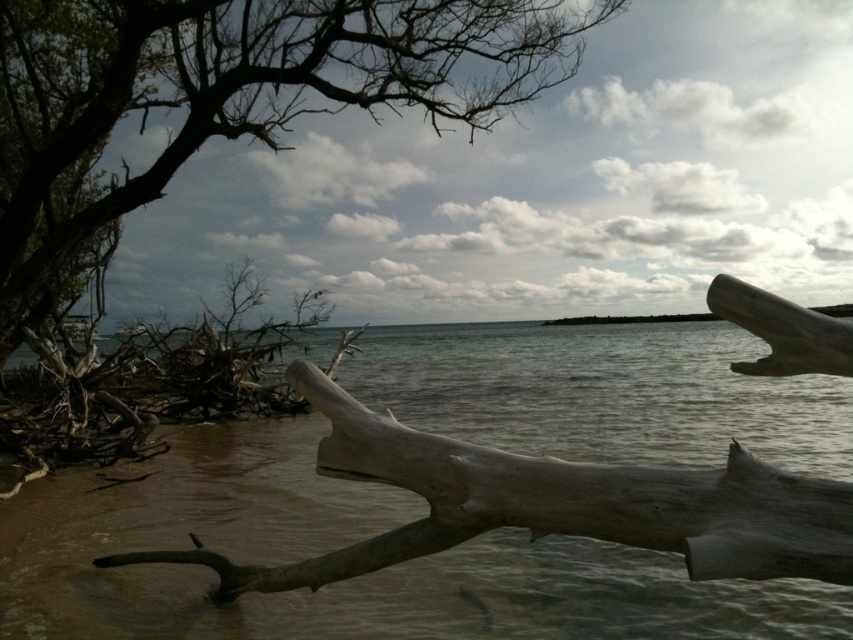
You are standing on the beach and see the clear water at center and the dark brown bark tree at upper left. Which object is closer to the ground?

The clear water at center is closer to the ground since it is located below the dark brown bark tree at upper left.

You are standing at the point marked by the coordinates point (352, 579) in this coastal scene. What type of environment are you currently in?

The point (352, 579) is clear water at center, so you are standing in clear water.

You are standing at the edge of the beach and see the clear water at center and the dark brown bark tree at upper left. Which object is nearer to you?

The clear water at center is closer to the viewer than the dark brown bark tree at upper left.